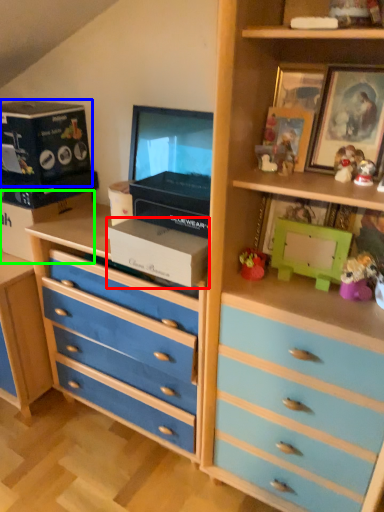
Question: Based on their relative distances, which object is nearer to box (highlighted by a red box)? Choose from box (highlighted by a blue box) and box (highlighted by a green box).

Choices:
 (A) box
 (B) box

Answer: (B)